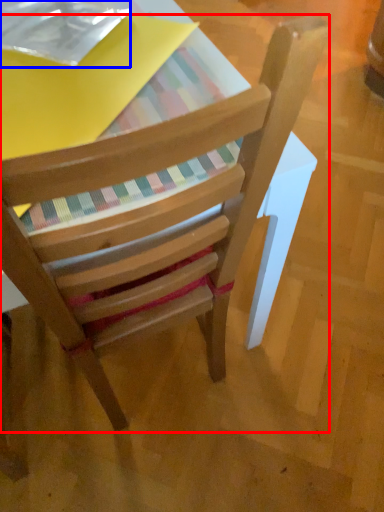
Question: Which object appears farthest to the camera in this image, chair (highlighted by a red box) or paperback book (highlighted by a blue box)?

Choices:
 (A) chair
 (B) paperback book

Answer: (B)